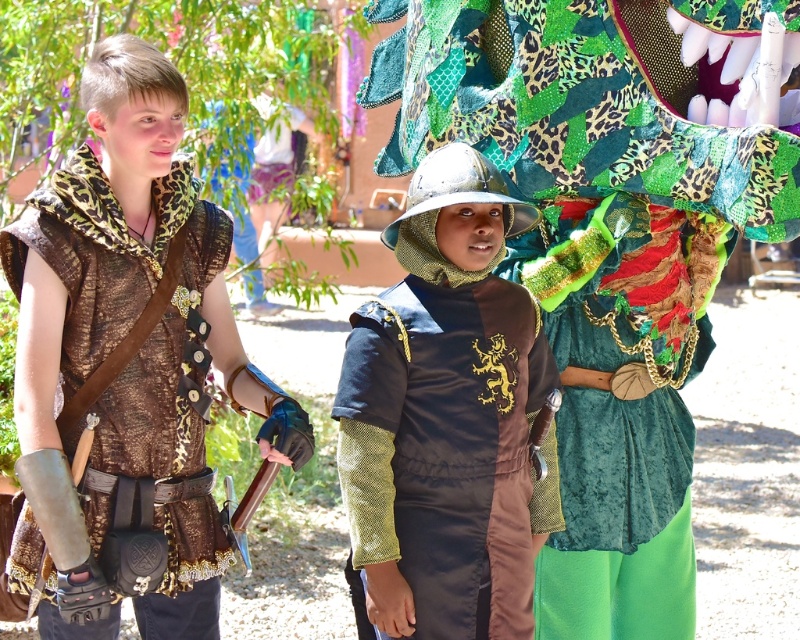
What do you see at coordinates (602, 236) in the screenshot? I see `velvet green dragon head at center` at bounding box center [602, 236].

Is point (652, 282) positioned in front of point (88, 513)?

No, (652, 282) is behind (88, 513).

Identify the location of velvet green dragon head at center. The height and width of the screenshot is (640, 800). tap(602, 236).

Can you confirm if velvet green dragon head at center is bigger than metallic silver helmet at center?

Actually, velvet green dragon head at center might be smaller than metallic silver helmet at center.

Consider the image. Which is more to the right, velvet green dragon head at center or metallic silver helmet at center?

velvet green dragon head at center

Is point (574, 538) in front of point (384, 426)?

No, it is behind (384, 426).

Find the location of a particular element. velvet green dragon head at center is located at coordinates (602, 236).

Where is `metallic silver helmet at center`? The width and height of the screenshot is (800, 640). metallic silver helmet at center is located at coordinates (448, 417).

Between metallic silver helmet at center and leopard print fabric vest at left, which one is positioned higher?

leopard print fabric vest at left

Between point (352, 323) and point (184, 289), which one is positioned in front?

Point (352, 323)

The image size is (800, 640). Find the location of `metallic silver helmet at center`. metallic silver helmet at center is located at coordinates (448, 417).